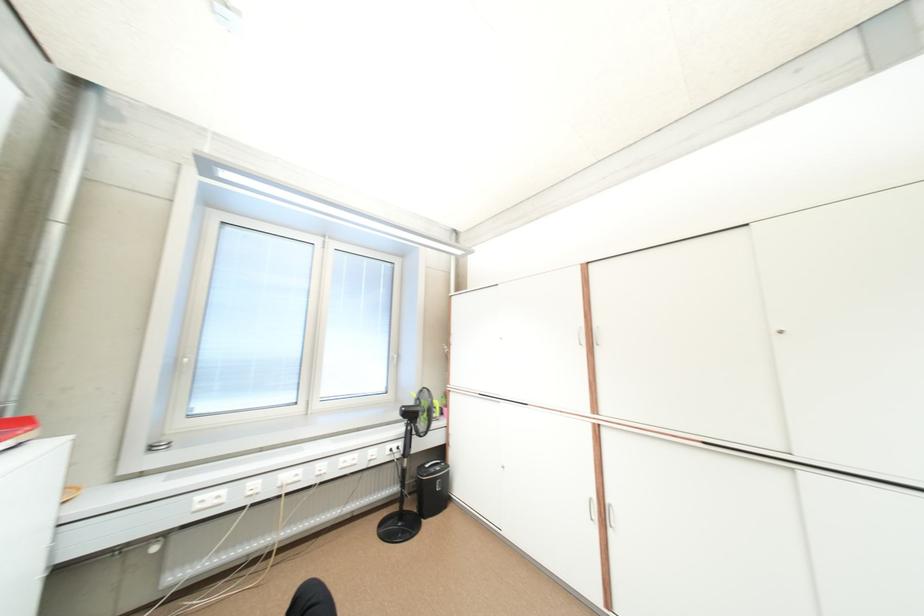
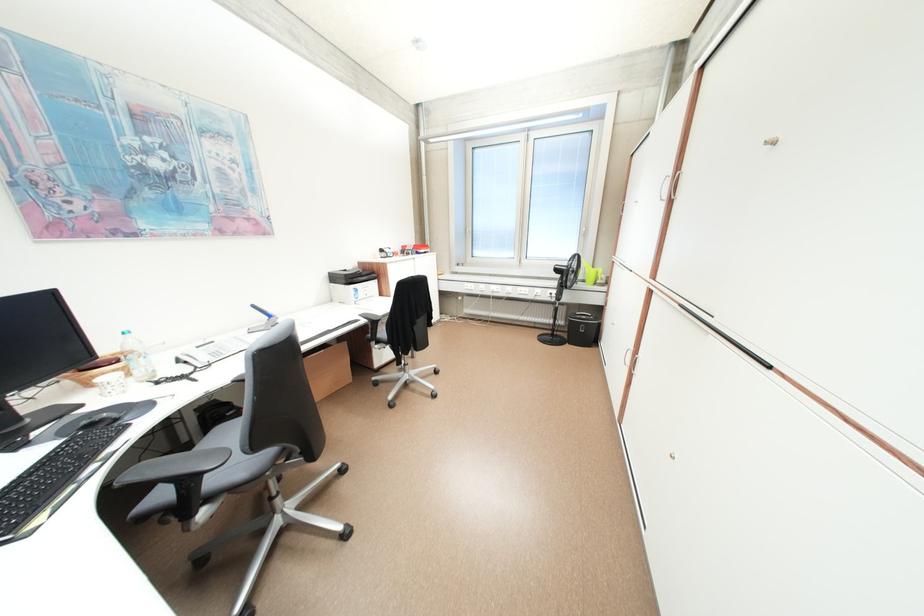
Find the pixel in the second image that matches (x=365, y=455) in the first image.

(537, 290)